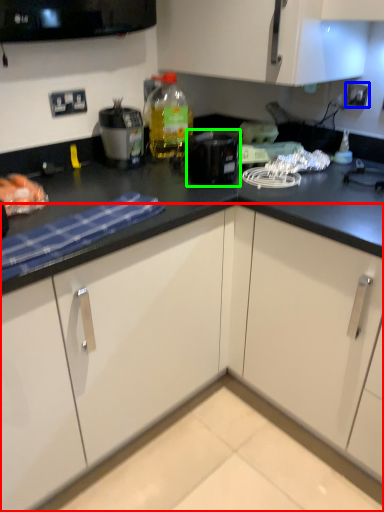
Question: Based on their relative distances, which object is nearer to cabinetry (highlighted by a red box)? Choose from electric outlet (highlighted by a blue box) and kitchen appliance (highlighted by a green box).

Choices:
 (A) electric outlet
 (B) kitchen appliance

Answer: (B)